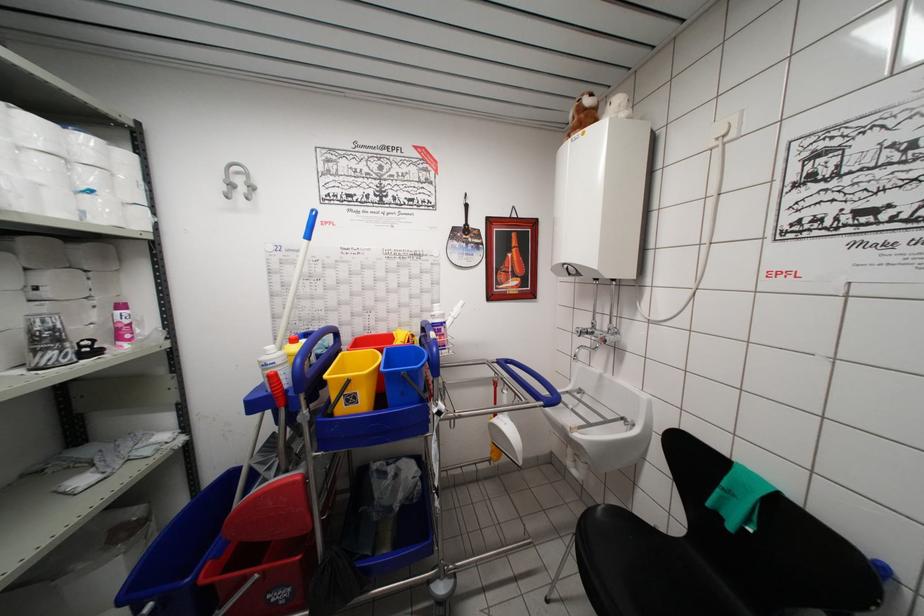
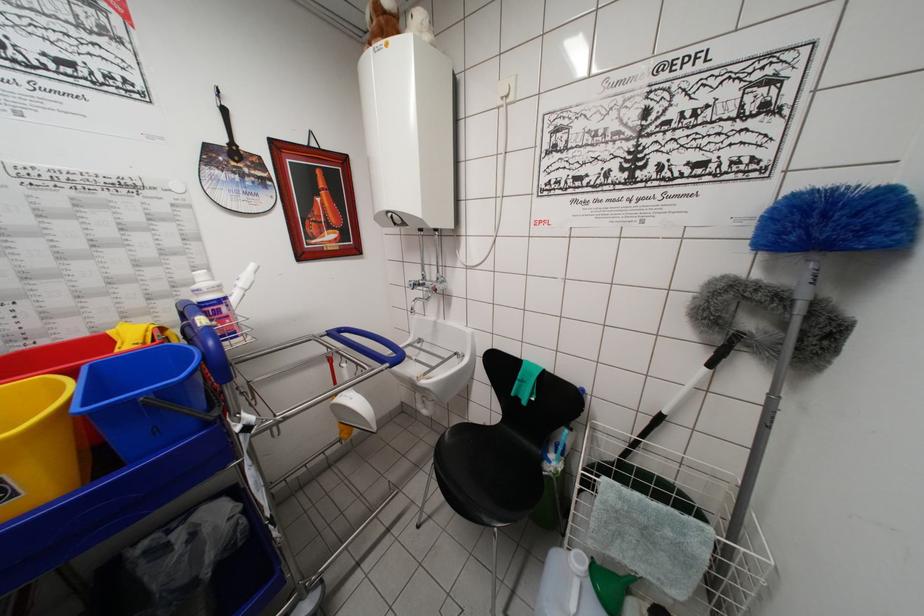
Locate, in the second image, the point that corresponds to [579,544] in the first image.

(438, 472)